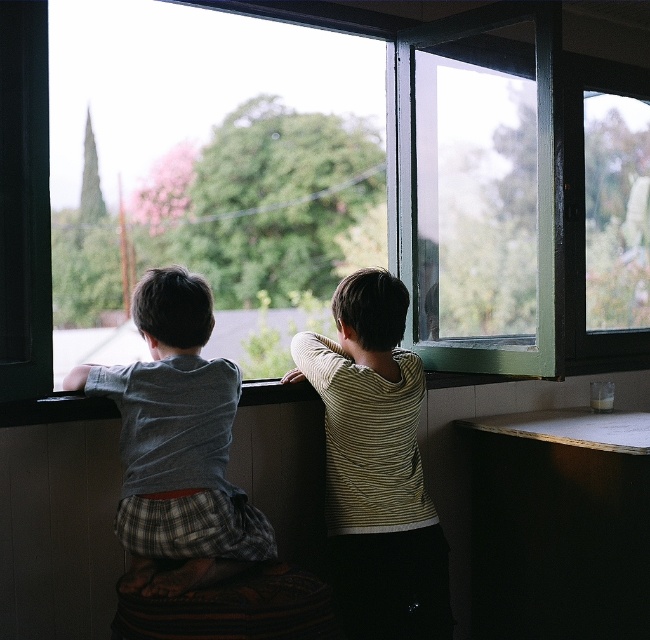
Is striped cotton shirt at center bigger than gray cotton shirt at left?

No.

Does striped cotton shirt at center have a greater width compared to gray cotton shirt at left?

No.

Is point (346, 516) farther from viewer compared to point (177, 342)?

Yes, point (346, 516) is behind point (177, 342).

I want to click on striped cotton shirt at center, so click(374, 465).

Can you confirm if green glass window at center is thinner than gray cotton shirt at left?

Indeed, green glass window at center has a lesser width compared to gray cotton shirt at left.

Describe the element at coordinates (23, 202) in the screenshot. I see `green glass window at center` at that location.

Locate an element on the screen. green glass window at center is located at coordinates (23, 202).

Is green glass window at center behind striped cotton shirt at center?

Yes.

Can you confirm if green glass window at center is wider than striped cotton shirt at center?

No, green glass window at center is not wider than striped cotton shirt at center.

What do you see at coordinates (23, 202) in the screenshot?
I see `green glass window at center` at bounding box center [23, 202].

At what (x,y) coordinates should I click in order to perform the action: click on green glass window at center. Please return your answer as a coordinate pair (x, y). This screenshot has width=650, height=640. Looking at the image, I should click on (23, 202).